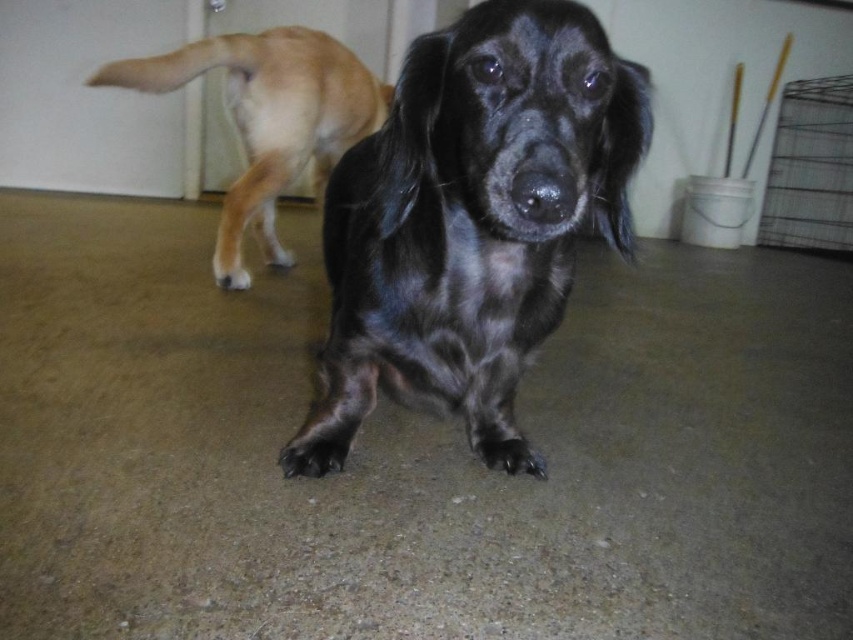
Question: Among these objects, which one is farthest from the camera?

Choices:
 (A) shiny black dog at center
 (B) shiny brown fur at upper left

Answer: (B)

Question: Which point is closer to the camera?

Choices:
 (A) (241, 180)
 (B) (421, 184)

Answer: (B)

Question: Is shiny black dog at center further to camera compared to shiny brown fur at upper left?

Choices:
 (A) no
 (B) yes

Answer: (A)

Question: Can you confirm if shiny black dog at center is wider than shiny brown fur at upper left?

Choices:
 (A) no
 (B) yes

Answer: (A)

Question: Does shiny black dog at center lie in front of shiny brown fur at upper left?

Choices:
 (A) no
 (B) yes

Answer: (B)